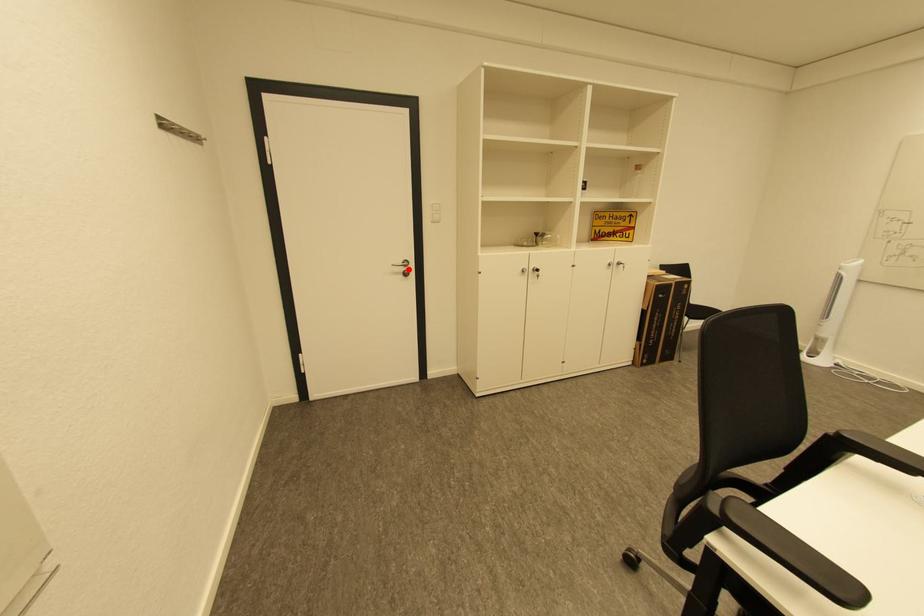
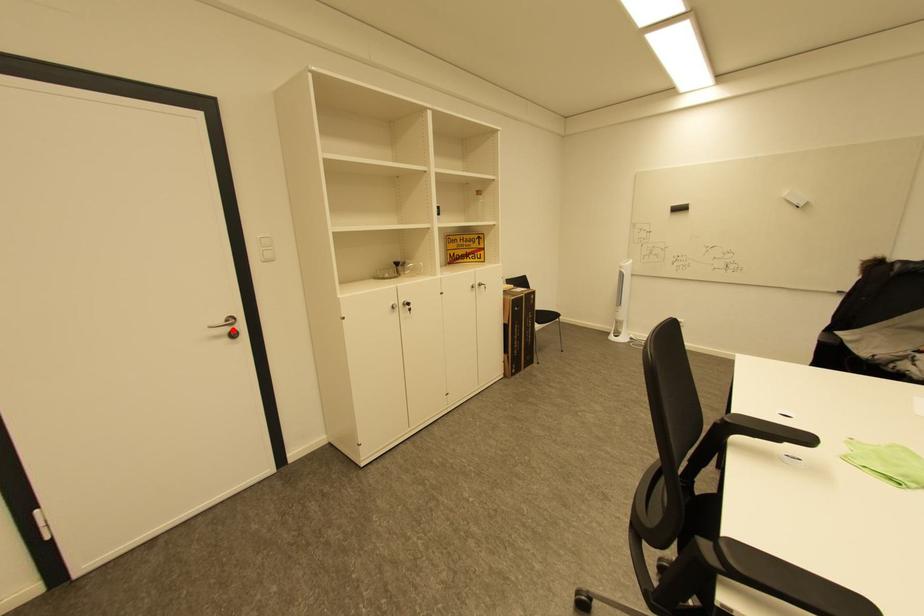
I am providing you with two images of the same scene from different viewpoints. A red point is marked on the first image and another point is marked on the second image. Does the point marked in image1 correspond to the same location as the one in image2?

Yes